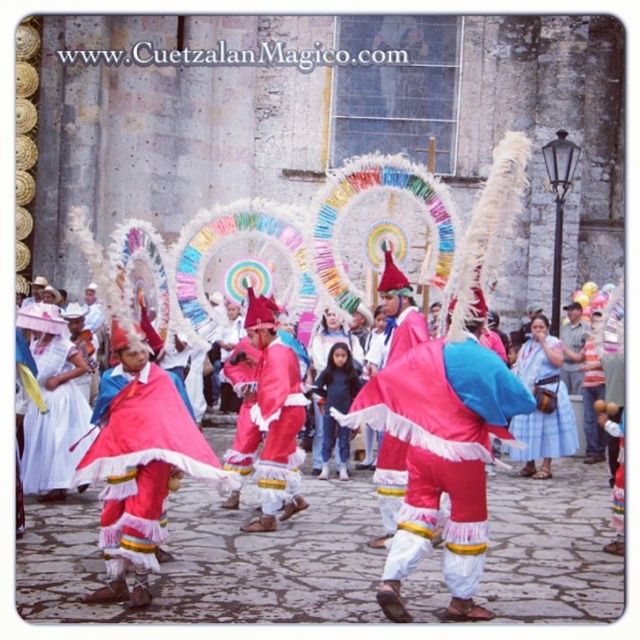
Does matte pink fabric at center appear on the left side of pink fabric costume at center?

In fact, matte pink fabric at center is to the right of pink fabric costume at center.

Identify the location of matte pink fabric at center. pos(442,449).

Is point (477, 364) in front of point (536, 349)?

Yes, it is.

Measure the distance between matte pink fabric at center and blue plaid skirt at center.

matte pink fabric at center is 9.15 meters away from blue plaid skirt at center.

This screenshot has width=640, height=640. Find the location of `matte pink fabric at center`. matte pink fabric at center is located at coordinates (442, 449).

Who is positioned more to the left, pink satin cape at center or blue plaid skirt at center?

From the viewer's perspective, pink satin cape at center appears more on the left side.

Locate an element on the screen. The width and height of the screenshot is (640, 640). pink satin cape at center is located at coordinates (140, 460).

Is point (104, 502) behind point (556, 444)?

That is False.

The width and height of the screenshot is (640, 640). Find the location of `pink satin cape at center`. pink satin cape at center is located at coordinates (140, 460).